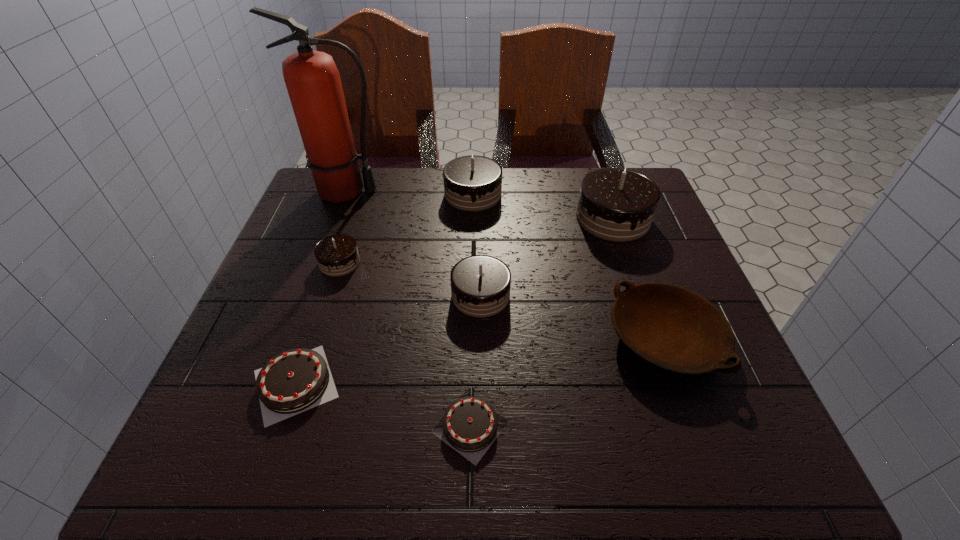
In the image, there is a desktop. What are the coordinates of `vacant space at the far edge` in the screenshot? It's located at (432, 199).

At what (x,y) coordinates should I click in order to perform the action: click on vacant position at the near edge of the desktop. Please return your answer as a coordinate pair (x, y). The height and width of the screenshot is (540, 960). Looking at the image, I should click on (655, 446).

Where is `free space at the left edge of the desktop`? free space at the left edge of the desktop is located at coordinates (286, 341).

The height and width of the screenshot is (540, 960). Identify the location of unoccupied area between the fifth shortest object and the third shortest object. (573, 317).

The height and width of the screenshot is (540, 960). What are the coordinates of `free spot between the second tallest chocolate cake and the third biggest chocolate chocolate cake` in the screenshot? It's located at (477, 245).

What are the coordinates of `vacant space in between the fire extinguisher and the second smallest chocolate chocolate cake` in the screenshot? It's located at (414, 243).

Locate an element on the screen. empty location between the third biggest chocolate chocolate cake and the plate is located at coordinates (573, 317).

At what (x,y) coordinates should I click in order to perform the action: click on free spot between the smallest chocolate chocolate cake and the fire extinguisher. Please return your answer as a coordinate pair (x, y). This screenshot has height=540, width=960. Looking at the image, I should click on (343, 227).

You are a GUI agent. You are given a task and a screenshot of the screen. Output one action in this format:
    pyautogui.click(x=<x>, y=<y>)
    Task: Click on the vacant area that lies between the fourth tallest object and the seventh shortest object
    The image size is (960, 540).
    Given the screenshot: What is the action you would take?
    pyautogui.click(x=547, y=256)

Find the location of a particular element. Image resolution: width=960 pixels, height=540 pixels. the fourth closest object to the shortest chocolate cake is located at coordinates (337, 255).